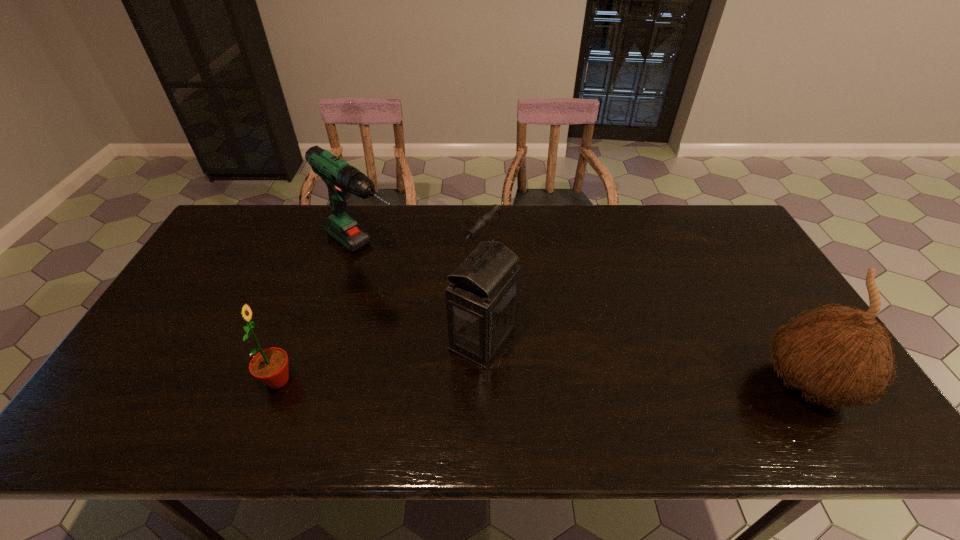
The height and width of the screenshot is (540, 960). In order to click on blank space located 0.340m on the handle side of the drill in this screenshot , I will do `click(469, 332)`.

The height and width of the screenshot is (540, 960). Identify the location of vacant space situated 0.340m on the handle side of the drill. (469, 332).

Identify the location of object at the far edge. (341, 178).

Identify the location of sunflower that is at the near edge. [270, 366].

Where is `coconut that is at the near edge`? Image resolution: width=960 pixels, height=540 pixels. coconut that is at the near edge is located at coordinates (841, 355).

Identify the location of lantern positioned at the near edge. The height and width of the screenshot is (540, 960). [x=481, y=299].

Where is `object located in the right edge section of the desktop`? The image size is (960, 540). object located in the right edge section of the desktop is located at coordinates (841, 355).

Locate an element on the screen. The height and width of the screenshot is (540, 960). object situated at the near right corner is located at coordinates (841, 355).

Identify the location of vacant space at the far edge of the desktop. (519, 205).

The image size is (960, 540). What are the coordinates of `free space at the near edge of the desktop` in the screenshot? It's located at (715, 394).